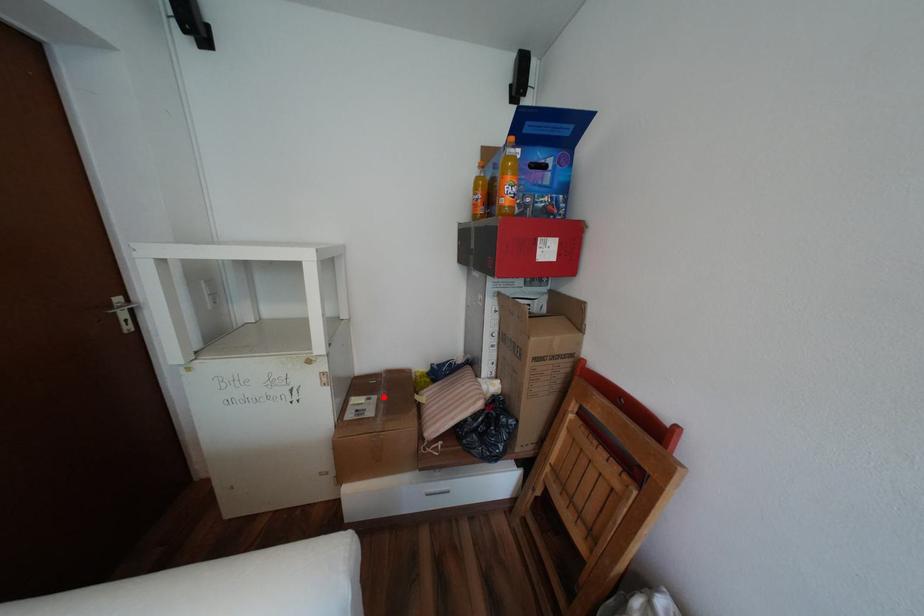
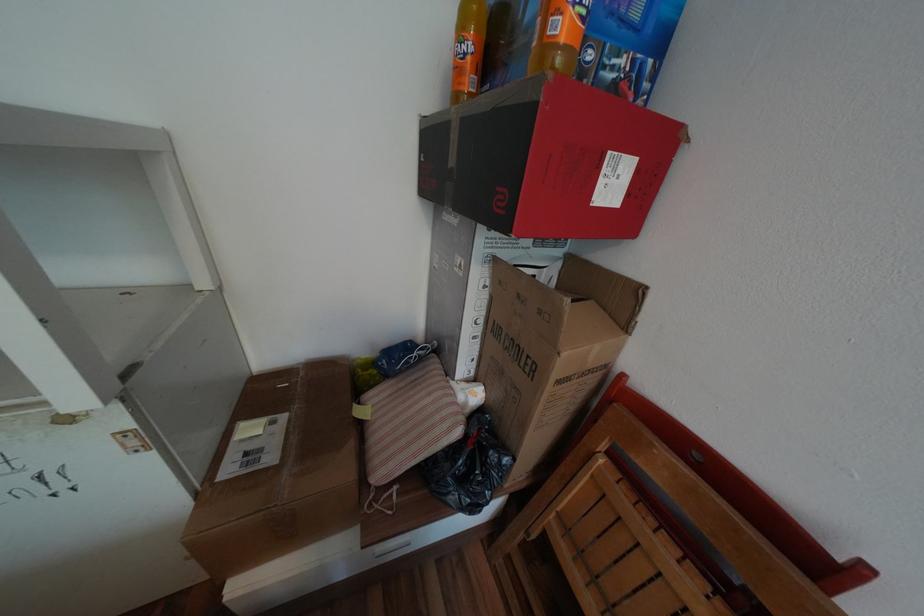
Question: I am providing you with two images of the same scene from different viewpoints. Image1 has a red point marked. In image2, the corresponding 3D location appears at what relative position? Reply with the corresponding letter.

Choices:
 (A) Closer
 (B) Farther

Answer: (B)